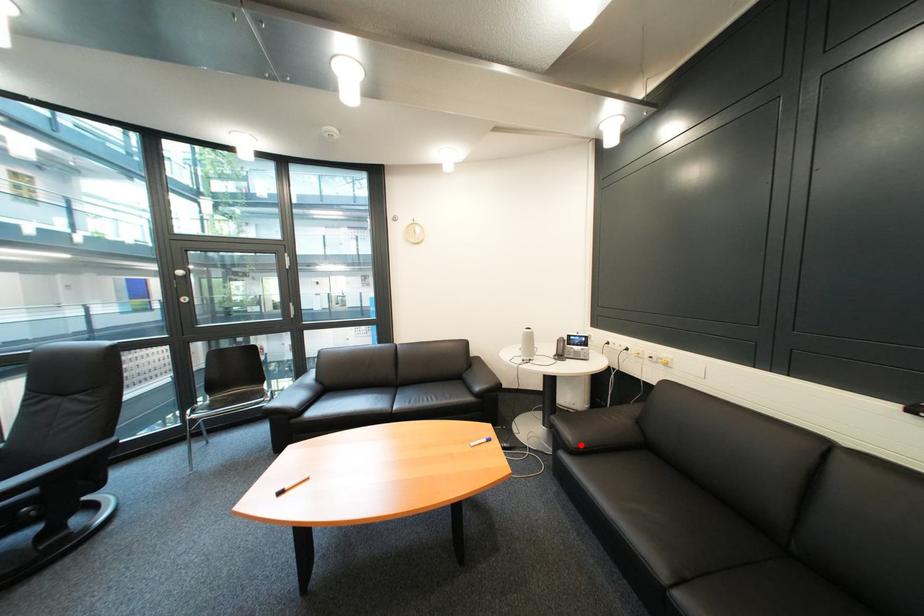
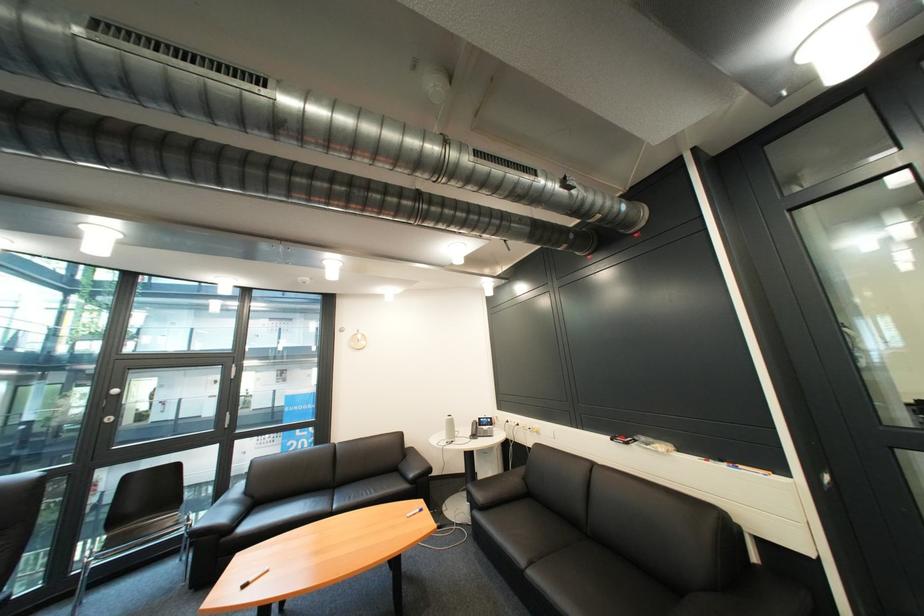
In the second image, find the point that corresponds to the highlighted location in the first image.

(491, 504)